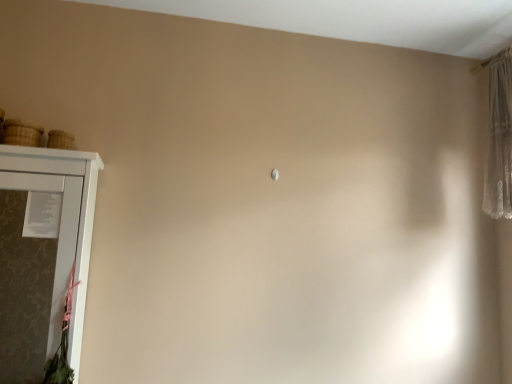
Question: Does woven straw basket at upper left, placed as the second basket when sorted from left to right, have a greater height compared to brown woven basket at left, the second basket from the right?

Choices:
 (A) yes
 (B) no

Answer: (B)

Question: Is woven straw basket at upper left, placed as the second basket when sorted from left to right, aimed at brown woven basket at left, the second basket from the right?

Choices:
 (A) yes
 (B) no

Answer: (B)

Question: From a real-world perspective, is woven straw basket at upper left, which appears as the 1th basket when viewed from the right, below brown woven basket at left, the second basket from the right?

Choices:
 (A) no
 (B) yes

Answer: (B)

Question: Can brown woven basket at left, the second basket from the right, be found inside woven straw basket at upper left, which appears as the 1th basket when viewed from the right?

Choices:
 (A) yes
 (B) no

Answer: (B)

Question: From the image's perspective, is woven straw basket at upper left, placed as the second basket when sorted from left to right, beneath brown woven basket at left, arranged as the 1th basket when viewed from the left?

Choices:
 (A) no
 (B) yes

Answer: (B)

Question: Is woven straw basket at upper left, placed as the second basket when sorted from left to right, inside or outside of white matte cupboard at left?

Choices:
 (A) inside
 (B) outside

Answer: (B)

Question: From the image's perspective, is woven straw basket at upper left, placed as the second basket when sorted from left to right, above or below white matte cupboard at left?

Choices:
 (A) below
 (B) above

Answer: (B)

Question: From a real-world perspective, is woven straw basket at upper left, placed as the second basket when sorted from left to right, above or below white matte cupboard at left?

Choices:
 (A) above
 (B) below

Answer: (A)

Question: Does point (64, 145) appear closer or farther from the camera than point (44, 241)?

Choices:
 (A) farther
 (B) closer

Answer: (B)

Question: From a real-world perspective, is woven straw basket at upper left, placed as the second basket when sorted from left to right, above or below brown woven basket at left, arranged as the 1th basket when viewed from the left?

Choices:
 (A) above
 (B) below

Answer: (B)

Question: Is point (53, 135) closer or farther from the camera than point (28, 125)?

Choices:
 (A) farther
 (B) closer

Answer: (A)

Question: Considering their positions, is woven straw basket at upper left, placed as the second basket when sorted from left to right, located in front of or behind brown woven basket at left, arranged as the 1th basket when viewed from the left?

Choices:
 (A) behind
 (B) front

Answer: (A)

Question: Is woven straw basket at upper left, which appears as the 1th basket when viewed from the right, bigger or smaller than brown woven basket at left, arranged as the 1th basket when viewed from the left?

Choices:
 (A) big
 (B) small

Answer: (B)

Question: Looking at their shapes, would you say white matte cupboard at left is wider or thinner than brown woven basket at left, the second basket from the right?

Choices:
 (A) wide
 (B) thin

Answer: (A)

Question: Is white matte cupboard at left to the left or to the right of brown woven basket at left, arranged as the 1th basket when viewed from the left, in the image?

Choices:
 (A) left
 (B) right

Answer: (B)